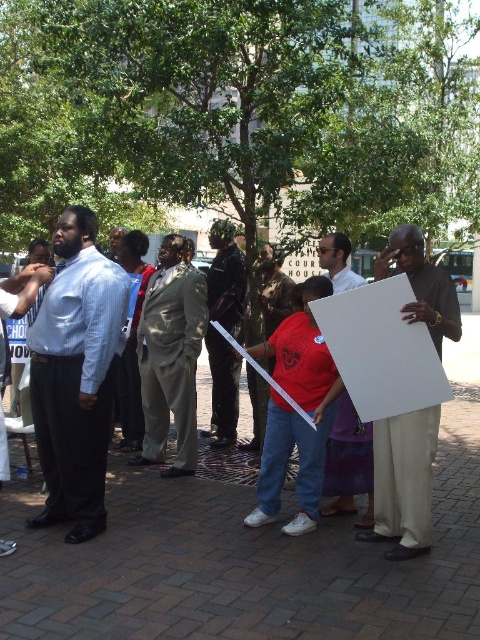
From the picture: You are standing in the public space near the courthouse. You see a point at coordinates (75,376). What object is located at that point?

The point at coordinates (75,376) corresponds to the light blue shirt at left.

Looking at this image, you are a photographer trying to capture a photo of the dark gray suit at center without the matte white sign at right blocking the view. Based on their heights, is this possible?

The matte white sign at right is not as tall as the dark gray suit at center, so the sign is shorter than the suit. Therefore, if the photographer positions themselves at a lower angle, they might be able to frame the shot so the suit is visible above the sign.